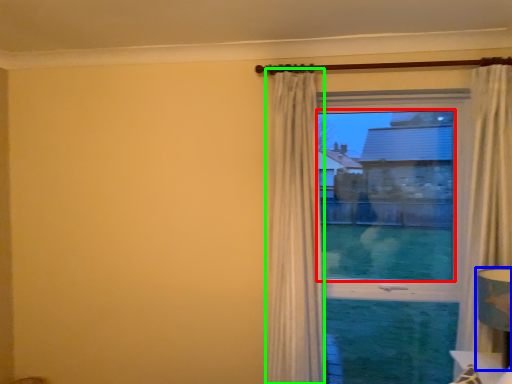
Question: Which object is the farthest from window screen (highlighted by a red box)? Choose among these: table lamp (highlighted by a blue box) or curtain (highlighted by a green box).

Choices:
 (A) table lamp
 (B) curtain

Answer: (A)